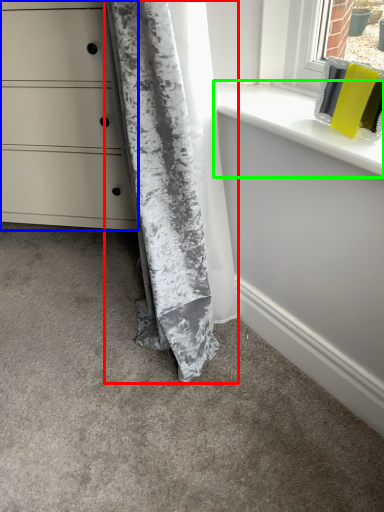
Question: Considering the real-world distances, which object is farthest from curtain (highlighted by a red box)? chest of drawers (highlighted by a blue box) or window sill (highlighted by a green box)?

Choices:
 (A) chest of drawers
 (B) window sill

Answer: (A)